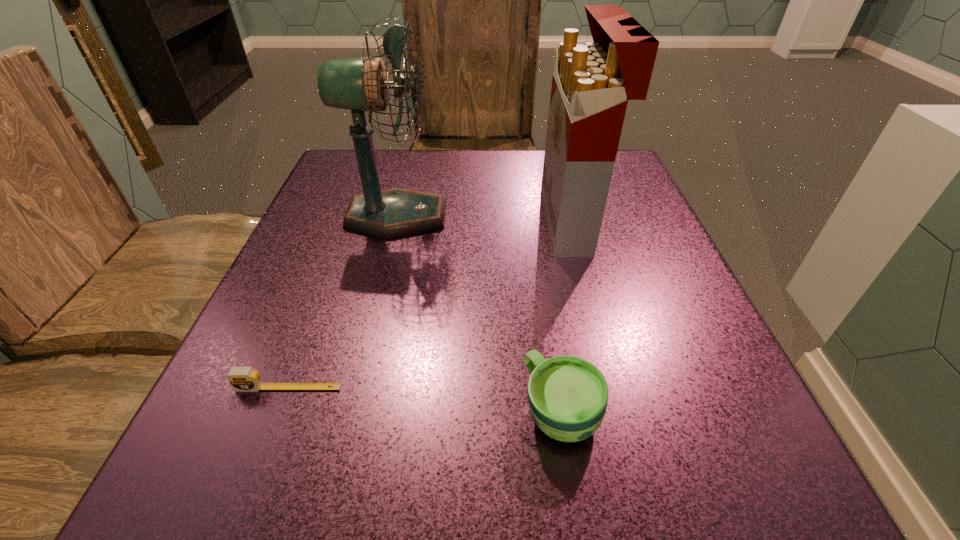
Where is `free space between the cigarette case and the shortest object`? The height and width of the screenshot is (540, 960). free space between the cigarette case and the shortest object is located at coordinates (430, 305).

Locate an element on the screen. The image size is (960, 540). vacant space in between the fan and the cigarette case is located at coordinates (484, 219).

Find the location of `vacant space that's between the third tallest object and the cigarette case`. vacant space that's between the third tallest object and the cigarette case is located at coordinates (566, 316).

Locate an element on the screen. The image size is (960, 540). object that stands as the second closest to the cigarette case is located at coordinates (568, 396).

At what (x,y) coordinates should I click in order to perform the action: click on object that stands as the second closest to the fan. Please return your answer as a coordinate pair (x, y). Looking at the image, I should click on (242, 379).

Identify the location of free space that satisfies the following two spatial constraints: 1. at the front of the shortest object with the tape extended; 2. on the left side of the third tallest object. (279, 411).

This screenshot has width=960, height=540. In order to click on vacant point that satisfies the following two spatial constraints: 1. in front of the fan where the wind blows; 2. at the front of the shortest object with the tape extended in this screenshot , I will do point(354,388).

Locate an element on the screen. vacant point that satisfies the following two spatial constraints: 1. in front of the fan where the wind blows; 2. on the right side of the third tallest object is located at coordinates (348, 411).

This screenshot has height=540, width=960. Find the location of `vacant position in the image that satisfies the following two spatial constraints: 1. at the front of the shortest object with the tape extended; 2. on the right side of the cup`. vacant position in the image that satisfies the following two spatial constraints: 1. at the front of the shortest object with the tape extended; 2. on the right side of the cup is located at coordinates (279, 411).